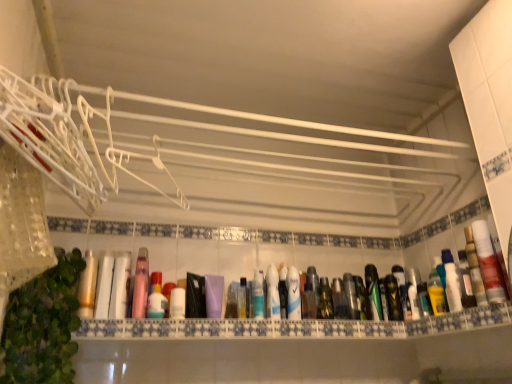
Question: Which direction should I rotate to look at white glossy mouthwash at center, positioned as the 5th mouthwash in left-to-right order?

Choices:
 (A) right
 (B) left

Answer: (A)

Question: Which direction should I rotate to face blue glossy mouthwash at center, which is counted as the fifth mouthwash, starting from the right, — up or down?

Choices:
 (A) up
 (B) down

Answer: (B)

Question: Is white matte tube at center, acting as the first mouthwash starting from the left, thinner than translucent plastic mouthwash at center, the 6th mouthwash when ordered from left to right?

Choices:
 (A) no
 (B) yes

Answer: (A)

Question: Is white matte tube at center, acting as the first mouthwash starting from the left, placed right next to translucent plastic mouthwash at center, the 6th mouthwash when ordered from left to right?

Choices:
 (A) yes
 (B) no

Answer: (B)

Question: Does white matte tube at center, acting as the first mouthwash starting from the left, have a greater width compared to translucent plastic mouthwash at center, marked as the third mouthwash in a right-to-left arrangement?

Choices:
 (A) no
 (B) yes

Answer: (B)

Question: Is white matte tube at center, marked as the 8th mouthwash in a right-to-left arrangement, further to the viewer compared to translucent plastic mouthwash at center, marked as the third mouthwash in a right-to-left arrangement?

Choices:
 (A) yes
 (B) no

Answer: (B)

Question: Is white matte tube at center, acting as the first mouthwash starting from the left, to the left of translucent plastic mouthwash at center, marked as the third mouthwash in a right-to-left arrangement, from the viewer's perspective?

Choices:
 (A) yes
 (B) no

Answer: (A)

Question: Is white matte tube at center, acting as the first mouthwash starting from the left, at the right side of translucent plastic mouthwash at center, the 6th mouthwash when ordered from left to right?

Choices:
 (A) yes
 (B) no

Answer: (B)

Question: Is translucent plastic mouthwash at center, the 6th mouthwash when ordered from left to right, positioned beyond the bounds of purple matte bottle at center, the 3th mouthwash from the left?

Choices:
 (A) yes
 (B) no

Answer: (A)

Question: From a real-world perspective, is translucent plastic mouthwash at center, marked as the third mouthwash in a right-to-left arrangement, physically below purple matte bottle at center, the sixth mouthwash viewed from the right?

Choices:
 (A) yes
 (B) no

Answer: (B)

Question: Is translucent plastic mouthwash at center, the 6th mouthwash when ordered from left to right, shorter than purple matte bottle at center, the 3th mouthwash from the left?

Choices:
 (A) yes
 (B) no

Answer: (B)

Question: Does translucent plastic mouthwash at center, the 6th mouthwash when ordered from left to right, have a smaller size compared to purple matte bottle at center, the 3th mouthwash from the left?

Choices:
 (A) yes
 (B) no

Answer: (A)

Question: Is translucent plastic mouthwash at center, marked as the third mouthwash in a right-to-left arrangement, thinner than purple matte bottle at center, the sixth mouthwash viewed from the right?

Choices:
 (A) yes
 (B) no

Answer: (A)

Question: Is translucent plastic mouthwash at center, the 6th mouthwash when ordered from left to right, positioned in front of purple matte bottle at center, the sixth mouthwash viewed from the right?

Choices:
 (A) yes
 (B) no

Answer: (B)

Question: From the image's perspective, does metallic silver spray can at center appear higher than green leafy plant at lower left?

Choices:
 (A) no
 (B) yes

Answer: (A)